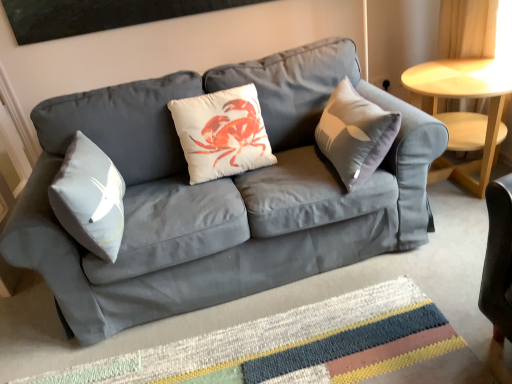
Question: Can you confirm if light wood/finished table at right is thinner than matte gray couch at center?

Choices:
 (A) yes
 (B) no

Answer: (A)

Question: Is light wood/finished table at right wider than matte gray couch at center?

Choices:
 (A) no
 (B) yes

Answer: (A)

Question: Does light wood/finished table at right have a smaller size compared to matte gray couch at center?

Choices:
 (A) yes
 (B) no

Answer: (A)

Question: Does light wood/finished table at right come in front of matte gray couch at center?

Choices:
 (A) yes
 (B) no

Answer: (B)

Question: From a real-world perspective, is light wood/finished table at right below matte gray couch at center?

Choices:
 (A) no
 (B) yes

Answer: (B)

Question: From the image's perspective, is light wood/finished table at right on top of matte gray couch at center?

Choices:
 (A) no
 (B) yes

Answer: (B)

Question: From the image's perspective, is light wood/finished table at right over multicolored woven mat at center?

Choices:
 (A) yes
 (B) no

Answer: (A)

Question: Is light wood/finished table at right with multicolored woven mat at center?

Choices:
 (A) yes
 (B) no

Answer: (B)

Question: Considering the relative sizes of light wood/finished table at right and multicolored woven mat at center in the image provided, is light wood/finished table at right bigger than multicolored woven mat at center?

Choices:
 (A) yes
 (B) no

Answer: (A)

Question: Is light wood/finished table at right positioned before multicolored woven mat at center?

Choices:
 (A) yes
 (B) no

Answer: (B)

Question: Could you tell me if light wood/finished table at right is facing multicolored woven mat at center?

Choices:
 (A) yes
 (B) no

Answer: (B)

Question: Considering the relative positions of light wood/finished table at right and multicolored woven mat at center in the image provided, is light wood/finished table at right behind multicolored woven mat at center?

Choices:
 (A) yes
 (B) no

Answer: (A)

Question: From the image's perspective, is multicolored woven mat at center located above matte gray couch at center?

Choices:
 (A) no
 (B) yes

Answer: (A)